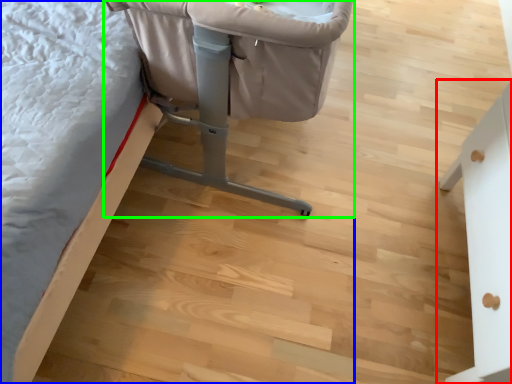
Question: Estimate the real-world distances between objects in this image. Which object is farther from furniture (highlighted by a red box), furniture (highlighted by a blue box) or furniture (highlighted by a green box)?

Choices:
 (A) furniture
 (B) furniture

Answer: (A)